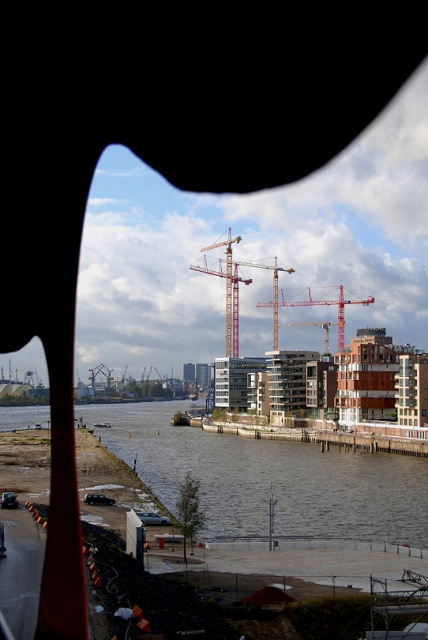
You are a delivery driver who needs to cross the brown concrete river at lower center to reach the construction site near the metallic construction crane at center. Is there a bridge or pathway between them?

The brown concrete river at lower center is located below the metallic construction crane at center, so there is no bridge or pathway between them. You will need to find an alternative route to reach the construction site.

You are a delivery driver who needs to cross the brown concrete river at lower center to reach the construction site near the metallic construction crane at center. Based on the scene, which direction should you head to move from the river to the crane?

The brown concrete river at lower center is to the left of metallic construction crane at center, so to move from the river to the crane, you should head to the right.